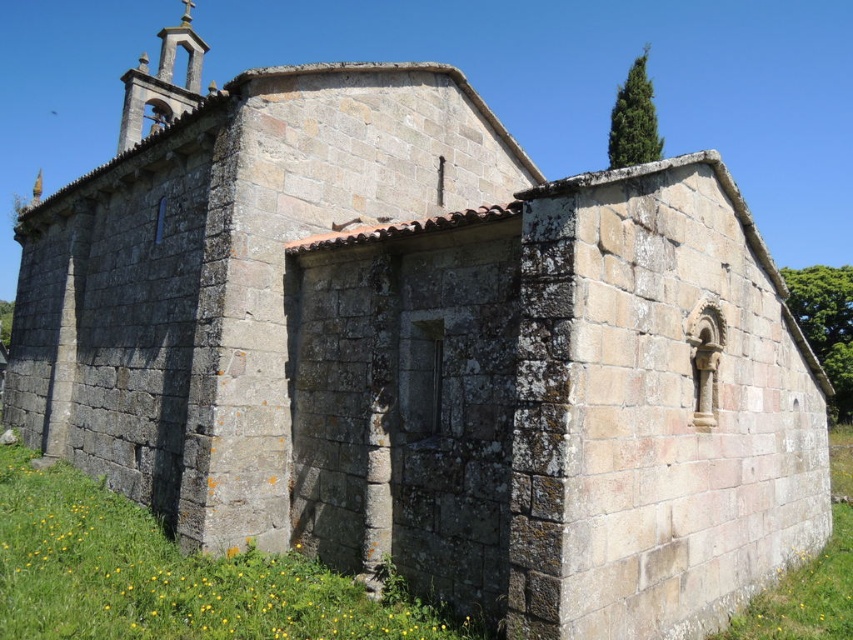
Question: Is green mossy stone wall at lower center bigger than green grass at lower right?

Choices:
 (A) yes
 (B) no

Answer: (B)

Question: Does green mossy stone wall at lower center have a larger size compared to green grass at lower right?

Choices:
 (A) yes
 (B) no

Answer: (B)

Question: Which point is closer to the camera taking this photo?

Choices:
 (A) (86, 589)
 (B) (792, 611)

Answer: (A)

Question: Does green mossy stone wall at lower center have a greater width compared to green grass at lower right?

Choices:
 (A) no
 (B) yes

Answer: (A)